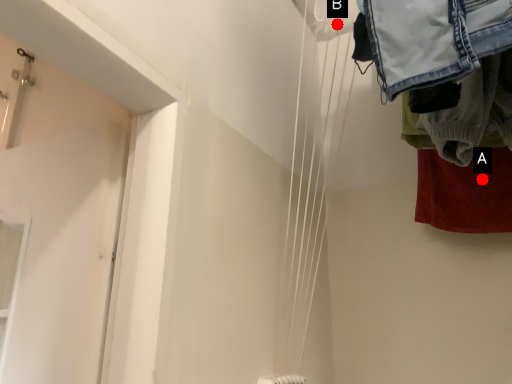
Question: Two points are circled on the image, labeled by A and B beside each circle. Which point appears farthest from the camera in this image?

Choices:
 (A) A is further
 (B) B is further

Answer: (B)